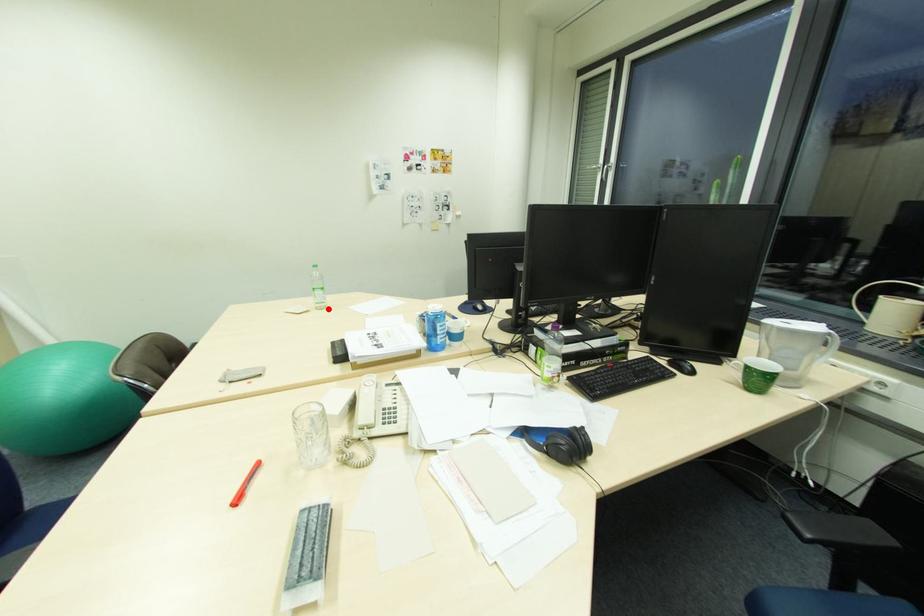
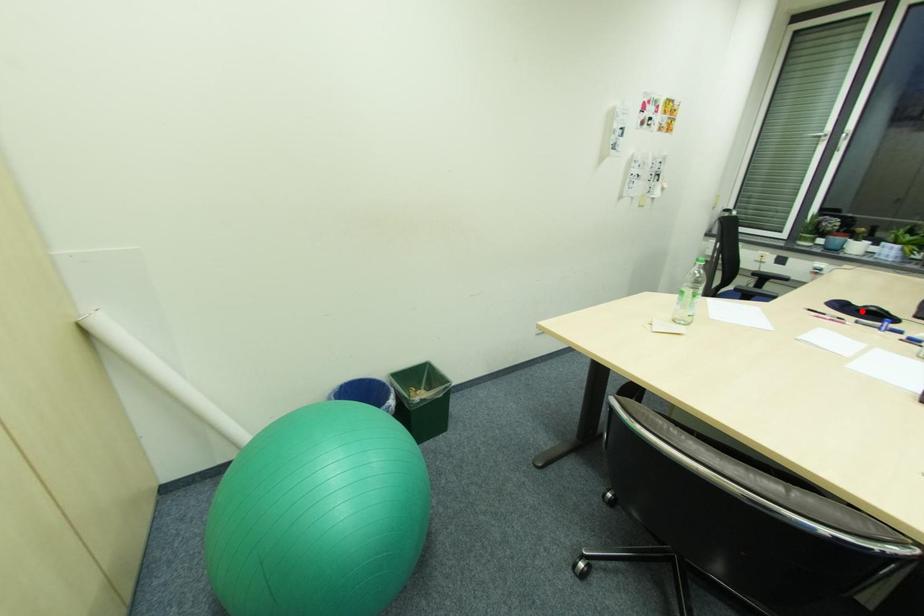
I am providing you with two images of the same scene from different viewpoints. A red point is marked on the first image and another point is marked on the second image. Are the points marked in image1 and image2 representing the same 3D position?

No